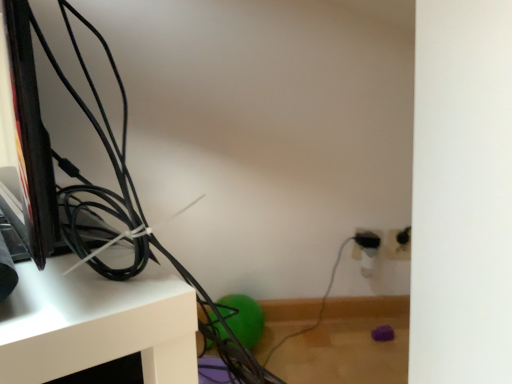
What is the approximate width of black plastic electric outlet at right, placed as the first electric outlet when sorted from left to right?

black plastic electric outlet at right, placed as the first electric outlet when sorted from left to right, is 0.52 inches in width.

Locate an element on the screen. The height and width of the screenshot is (384, 512). black plastic electric outlet at right, marked as the second electric outlet in a right-to-left arrangement is located at coordinates (369, 231).

Describe the element at coordinates (96, 324) in the screenshot. The height and width of the screenshot is (384, 512). I see `white glossy shelf at upper left` at that location.

Find the location of a particular element. black plastic electric outlet at right, marked as the second electric outlet in a right-to-left arrangement is located at coordinates (369, 231).

How different are the orientations of white plastic electric outlet at lower right, the 1th electric outlet in the right-to-left sequence, and black plastic electric outlet at right, placed as the first electric outlet when sorted from left to right, in degrees?

0.0636 degrees separate the facing orientations of white plastic electric outlet at lower right, the 1th electric outlet in the right-to-left sequence, and black plastic electric outlet at right, placed as the first electric outlet when sorted from left to right.

Does white plastic electric outlet at lower right, the 2th electric outlet from the left, have a larger size compared to black plastic electric outlet at right, marked as the second electric outlet in a right-to-left arrangement?

Actually, white plastic electric outlet at lower right, the 2th electric outlet from the left, might be smaller than black plastic electric outlet at right, marked as the second electric outlet in a right-to-left arrangement.

Is black plastic electric outlet at right, placed as the first electric outlet when sorted from left to right, inside white plastic electric outlet at lower right, the 2th electric outlet from the left?

That's incorrect, black plastic electric outlet at right, placed as the first electric outlet when sorted from left to right, is not inside white plastic electric outlet at lower right, the 2th electric outlet from the left.

From the picture: Could you tell me if white plastic electric outlet at lower right, the 1th electric outlet in the right-to-left sequence, is facing black plastic electric outlet at right, placed as the first electric outlet when sorted from left to right?

No, white plastic electric outlet at lower right, the 1th electric outlet in the right-to-left sequence, is not facing towards black plastic electric outlet at right, placed as the first electric outlet when sorted from left to right.

Would you say white plastic electric outlet at lower right, the 1th electric outlet in the right-to-left sequence, is inside or outside white glossy shelf at upper left?

white plastic electric outlet at lower right, the 1th electric outlet in the right-to-left sequence, is located beyond the bounds of white glossy shelf at upper left.

Is white plastic electric outlet at lower right, the 2th electric outlet from the left, positioned with its back to white glossy shelf at upper left?

No, white plastic electric outlet at lower right, the 2th electric outlet from the left, is not facing the opposite direction of white glossy shelf at upper left.

From the image's perspective, which object appears higher, white plastic electric outlet at lower right, the 1th electric outlet in the right-to-left sequence, or white glossy shelf at upper left?

white plastic electric outlet at lower right, the 1th electric outlet in the right-to-left sequence, is shown above in the image.

Which is less distant, (393, 257) or (153, 306)?

The point (153, 306) is more forward.

From the image's perspective, does black plastic electric outlet at right, placed as the first electric outlet when sorted from left to right, appear higher than white plastic electric outlet at lower right, the 1th electric outlet in the right-to-left sequence?

Actually, black plastic electric outlet at right, placed as the first electric outlet when sorted from left to right, appears below white plastic electric outlet at lower right, the 1th electric outlet in the right-to-left sequence, in the image.

Is black plastic electric outlet at right, placed as the first electric outlet when sorted from left to right, positioned far away from white plastic electric outlet at lower right, the 2th electric outlet from the left?

No.

Considering the relative sizes of black plastic electric outlet at right, marked as the second electric outlet in a right-to-left arrangement, and white plastic electric outlet at lower right, the 2th electric outlet from the left, in the image provided, is black plastic electric outlet at right, marked as the second electric outlet in a right-to-left arrangement, thinner than white plastic electric outlet at lower right, the 2th electric outlet from the left,?

No, black plastic electric outlet at right, marked as the second electric outlet in a right-to-left arrangement, is not thinner than white plastic electric outlet at lower right, the 2th electric outlet from the left.

Can you confirm if black plastic electric outlet at right, placed as the first electric outlet when sorted from left to right, is shorter than white glossy shelf at upper left?

Indeed, black plastic electric outlet at right, placed as the first electric outlet when sorted from left to right, has a lesser height compared to white glossy shelf at upper left.

How far apart are black plastic electric outlet at right, placed as the first electric outlet when sorted from left to right, and white glossy shelf at upper left?

black plastic electric outlet at right, placed as the first electric outlet when sorted from left to right, and white glossy shelf at upper left are 35.57 inches apart.

Between black plastic electric outlet at right, placed as the first electric outlet when sorted from left to right, and white glossy shelf at upper left, which one has smaller size?

Smaller between the two is black plastic electric outlet at right, placed as the first electric outlet when sorted from left to right.

Which is in front, black plastic electric outlet at right, marked as the second electric outlet in a right-to-left arrangement, or white glossy shelf at upper left?

white glossy shelf at upper left is more forward.

From the image's perspective, is white glossy shelf at upper left above or below white plastic electric outlet at lower right, the 2th electric outlet from the left?

white glossy shelf at upper left is below white plastic electric outlet at lower right, the 2th electric outlet from the left.

Which of these two, white glossy shelf at upper left or white plastic electric outlet at lower right, the 2th electric outlet from the left, is smaller?

With smaller size is white plastic electric outlet at lower right, the 2th electric outlet from the left.

Are white glossy shelf at upper left and white plastic electric outlet at lower right, the 1th electric outlet in the right-to-left sequence, located far from each other?

No, white glossy shelf at upper left is not far away from white plastic electric outlet at lower right, the 1th electric outlet in the right-to-left sequence.

Looking at this image, which object is more forward, white glossy shelf at upper left or black plastic electric outlet at right, marked as the second electric outlet in a right-to-left arrangement?

white glossy shelf at upper left is closer to the camera.

Between point (188, 367) and point (380, 230), which one is positioned behind?

Positioned behind is point (380, 230).

Locate an element on the screen. The height and width of the screenshot is (384, 512). furniture below the black plastic electric outlet at right, placed as the first electric outlet when sorted from left to right (from a real-world perspective) is located at coordinates (96, 324).

Identify the location of electric outlet that is on the right side of black plastic electric outlet at right, marked as the second electric outlet in a right-to-left arrangement. The width and height of the screenshot is (512, 384). (399, 244).

The image size is (512, 384). I want to click on furniture located in front of the white plastic electric outlet at lower right, the 2th electric outlet from the left, so pos(96,324).

From the image, which object appears to be nearer to black plastic electric outlet at right, marked as the second electric outlet in a right-to-left arrangement, white glossy shelf at upper left or white plastic electric outlet at lower right, the 2th electric outlet from the left?

The object closer to black plastic electric outlet at right, marked as the second electric outlet in a right-to-left arrangement, is white plastic electric outlet at lower right, the 2th electric outlet from the left.

When comparing their distances from white plastic electric outlet at lower right, the 2th electric outlet from the left, does black plastic electric outlet at right, marked as the second electric outlet in a right-to-left arrangement, or white glossy shelf at upper left seem closer?

Based on the image, black plastic electric outlet at right, marked as the second electric outlet in a right-to-left arrangement, appears to be nearer to white plastic electric outlet at lower right, the 2th electric outlet from the left.

When comparing their distances from white plastic electric outlet at lower right, the 2th electric outlet from the left, does white glossy shelf at upper left or black plastic electric outlet at right, placed as the first electric outlet when sorted from left to right, seem closer?

The object closer to white plastic electric outlet at lower right, the 2th electric outlet from the left, is black plastic electric outlet at right, placed as the first electric outlet when sorted from left to right.

Estimate the real-world distances between objects in this image. Which object is further from white glossy shelf at upper left, white plastic electric outlet at lower right, the 1th electric outlet in the right-to-left sequence, or black plastic electric outlet at right, marked as the second electric outlet in a right-to-left arrangement?

white plastic electric outlet at lower right, the 1th electric outlet in the right-to-left sequence, is further to white glossy shelf at upper left.

From the image, which object appears to be farther from white glossy shelf at upper left, black plastic electric outlet at right, placed as the first electric outlet when sorted from left to right, or white plastic electric outlet at lower right, the 2th electric outlet from the left?

white plastic electric outlet at lower right, the 2th electric outlet from the left, is further to white glossy shelf at upper left.

Which object lies further to the anchor point black plastic electric outlet at right, placed as the first electric outlet when sorted from left to right, white plastic electric outlet at lower right, the 1th electric outlet in the right-to-left sequence, or white glossy shelf at upper left?

white glossy shelf at upper left.

You are a GUI agent. You are given a task and a screenshot of the screen. Output one action in this format:
    pyautogui.click(x=<x>, y=<y>)
    Task: Click on the electric outlet between white glossy shelf at upper left and white plastic electric outlet at lower right, the 2th electric outlet from the left, from front to back
    
    Given the screenshot: What is the action you would take?
    pyautogui.click(x=369, y=231)